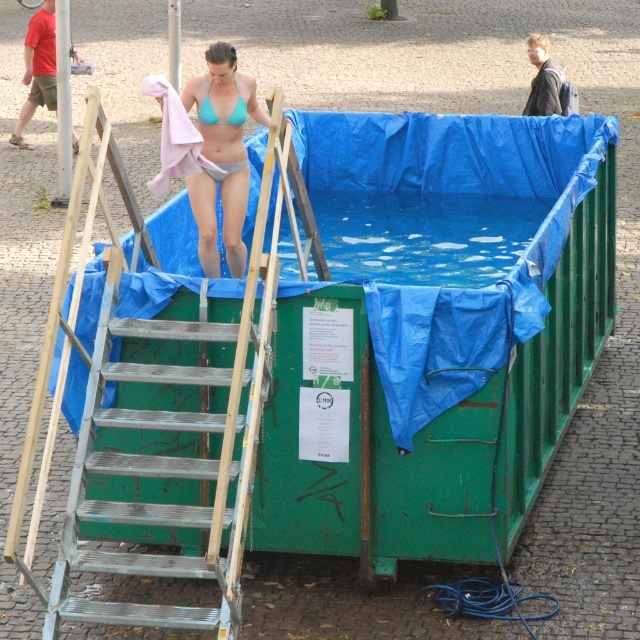
From the picture: You are a photographer taking a picture of the teal matte bikini at center. Where should you position your camera to capture the exact center of the bikini?

The exact center of the teal matte bikini at center is located at the 2D coordinates point (221, 154), so you should position your camera to focus on that point to capture the center.

You are a lifeguard standing on the deck of the pool. You need to reach the teal matte bikini top at upper center which is floating in the water. The metallic silver ladder at left is your only tool. Can you use the ladder to reach the bikini top?

The metallic silver ladder at left is much taller than the teal matte bikini top at upper center, so yes, the ladder can be used to reach the bikini top as it is taller and provides sufficient height.